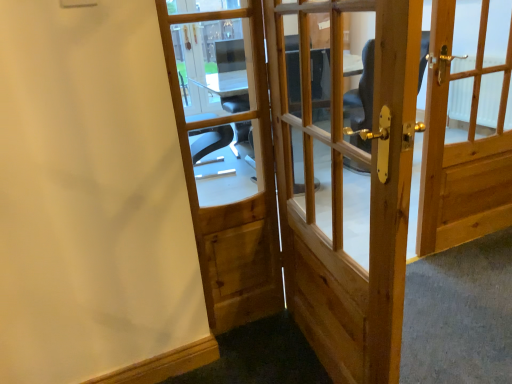
Question: Is natural wood door at center, which appears as the 2th door when viewed from the left, shorter than natural wood door at right, which is the first door from right to left?

Choices:
 (A) no
 (B) yes

Answer: (A)

Question: Is natural wood door at center, the 2th door when ordered from right to left, closer to the viewer compared to natural wood door at right, the 3th door when ordered from left to right?

Choices:
 (A) yes
 (B) no

Answer: (A)

Question: Is natural wood door at center, which appears as the 2th door when viewed from the left, to the right of natural wood door at right, which is the first door from right to left, from the viewer's perspective?

Choices:
 (A) yes
 (B) no

Answer: (B)

Question: Considering the relative sizes of natural wood door at center, the 2th door when ordered from right to left, and natural wood door at right, which is the first door from right to left, in the image provided, is natural wood door at center, the 2th door when ordered from right to left, bigger than natural wood door at right, which is the first door from right to left,?

Choices:
 (A) yes
 (B) no

Answer: (A)

Question: From the image's perspective, does natural wood door at center, the 2th door when ordered from right to left, appear higher than natural wood door at right, the 3th door when ordered from left to right?

Choices:
 (A) no
 (B) yes

Answer: (A)

Question: Are natural wood door at center, the 2th door when ordered from right to left, and natural wood door at right, the 3th door when ordered from left to right, located far from each other?

Choices:
 (A) no
 (B) yes

Answer: (A)

Question: Can you confirm if natural wood door at center, the 1th door viewed from the left, is thinner than natural wood door at center, the 2th door when ordered from right to left?

Choices:
 (A) no
 (B) yes

Answer: (B)

Question: Is natural wood door at center, the 1th door viewed from the left, at the right side of natural wood door at center, the 2th door when ordered from right to left?

Choices:
 (A) yes
 (B) no

Answer: (B)

Question: From the image's perspective, is natural wood door at center, the 1th door viewed from the left, over natural wood door at center, the 2th door when ordered from right to left?

Choices:
 (A) no
 (B) yes

Answer: (B)

Question: Is there a large distance between natural wood door at center, the 1th door viewed from the left, and natural wood door at center, which appears as the 2th door when viewed from the left?

Choices:
 (A) yes
 (B) no

Answer: (A)

Question: From the image's perspective, is natural wood door at center, the 1th door viewed from the left, beneath natural wood door at center, which appears as the 2th door when viewed from the left?

Choices:
 (A) yes
 (B) no

Answer: (B)

Question: Is natural wood door at center, which is counted as the third door, starting from the right, oriented away from natural wood door at center, the 2th door when ordered from right to left?

Choices:
 (A) yes
 (B) no

Answer: (B)

Question: Does natural wood door at right, which is the first door from right to left, have a larger size compared to natural wood door at center, the 1th door viewed from the left?

Choices:
 (A) no
 (B) yes

Answer: (B)